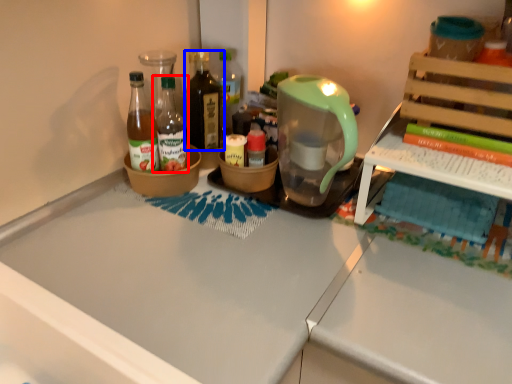
Question: Which object appears closest to the camera in this image, bottle (highlighted by a red box) or bottle (highlighted by a blue box)?

Choices:
 (A) bottle
 (B) bottle

Answer: (A)